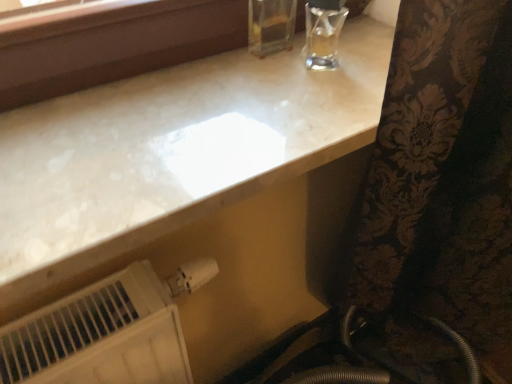
Describe the element at coordinates (106, 332) in the screenshot. I see `white plastic radiator at lower left` at that location.

In order to face white plastic radiator at lower left, should I rotate leftwards or rightwards?

You should look left and rotate roughly 14.308 degrees.

What are the coordinates of `white plastic radiator at lower left` in the screenshot? It's located at (106, 332).

Identify the location of white marble countertop at upper center. (176, 141).

What do you see at coordinates (176, 141) in the screenshot? I see `white marble countertop at upper center` at bounding box center [176, 141].

Find the location of a particular element. The width and height of the screenshot is (512, 384). white plastic radiator at lower left is located at coordinates (106, 332).

Can you confirm if white plastic radiator at lower left is positioned to the right of white marble countertop at upper center?

No.

Is white plastic radiator at lower left in front of or behind white marble countertop at upper center in the image?

In the image, white plastic radiator at lower left appears behind white marble countertop at upper center.

Does point (95, 350) come in front of point (58, 108)?

That is True.

From the image's perspective, is white plastic radiator at lower left above white marble countertop at upper center?

No, from the image's perspective, white plastic radiator at lower left is not above white marble countertop at upper center.

Consider the image. From a real-world perspective, is white plastic radiator at lower left physically above white marble countertop at upper center?

No, from a real-world perspective, white plastic radiator at lower left is not above white marble countertop at upper center.

Which of these two, white plastic radiator at lower left or white marble countertop at upper center, is wider?

With larger width is white marble countertop at upper center.

In terms of height, does white plastic radiator at lower left look taller or shorter compared to white marble countertop at upper center?

Clearly, white plastic radiator at lower left is taller compared to white marble countertop at upper center.

Considering the sizes of white plastic radiator at lower left and white marble countertop at upper center in the image, is white plastic radiator at lower left bigger or smaller than white marble countertop at upper center?

Considering their sizes, white plastic radiator at lower left takes up more space than white marble countertop at upper center.

Is white plastic radiator at lower left located outside white marble countertop at upper center?

Yes, white plastic radiator at lower left is located beyond the bounds of white marble countertop at upper center.

Would you say white plastic radiator at lower left is a long distance from white marble countertop at upper center?

No, white plastic radiator at lower left is in close proximity to white marble countertop at upper center.

Is white marble countertop at upper center at the back of white plastic radiator at lower left?

No, white plastic radiator at lower left is not facing away from white marble countertop at upper center.

In the image, there is a white marble countertop at upper center. Identify the location of water heater below it (from the image's perspective). click(x=106, y=332).

Between white marble countertop at upper center and white plastic radiator at lower left, which one appears on the right side from the viewer's perspective?

From the viewer's perspective, white marble countertop at upper center appears more on the right side.

Based on the photo, is white marble countertop at upper center positioned behind white plastic radiator at lower left?

No, it is not.

Is point (123, 137) farther from camera compared to point (19, 360)?

No, (123, 137) is closer to viewer.

From the image's perspective, is white marble countertop at upper center located above white plastic radiator at lower left?

Yes.

From a real-world perspective, is white marble countertop at upper center above or below white plastic radiator at lower left?

Clearly, from a real-world perspective, white marble countertop at upper center is above white plastic radiator at lower left.

Considering the sizes of objects white marble countertop at upper center and white plastic radiator at lower left in the image provided, who is wider, white marble countertop at upper center or white plastic radiator at lower left?

white marble countertop at upper center.

From their relative heights in the image, would you say white marble countertop at upper center is taller or shorter than white plastic radiator at lower left?

In the image, white marble countertop at upper center appears to be shorter than white plastic radiator at lower left.

Is white marble countertop at upper center bigger than white plastic radiator at lower left?

Actually, white marble countertop at upper center might be smaller than white plastic radiator at lower left.

Is white marble countertop at upper center surrounding white plastic radiator at lower left?

No, white plastic radiator at lower left is not inside white marble countertop at upper center.

Looking at this image, is white marble countertop at upper center in contact with white plastic radiator at lower left?

No, white marble countertop at upper center is not making contact with white plastic radiator at lower left.

Could you tell me if white marble countertop at upper center is facing white plastic radiator at lower left?

No, white marble countertop at upper center is not aimed at white plastic radiator at lower left.

How many degrees apart are the facing directions of white marble countertop at upper center and white plastic radiator at lower left?

The angle between the facing direction of white marble countertop at upper center and the facing direction of white plastic radiator at lower left is 1.24 degrees.

How much distance is there between white marble countertop at upper center and white plastic radiator at lower left?

A distance of 10.14 inches exists between white marble countertop at upper center and white plastic radiator at lower left.

Locate an element on the screen. This screenshot has height=384, width=512. countertop located above the white plastic radiator at lower left (from the image's perspective) is located at coordinates (176, 141).

Locate an element on the screen. This screenshot has height=384, width=512. countertop to the right of white plastic radiator at lower left is located at coordinates (176, 141).

At what (x,y) coordinates should I click in order to perform the action: click on water heater behind the white marble countertop at upper center. Please return your answer as a coordinate pair (x, y). Looking at the image, I should click on (106, 332).